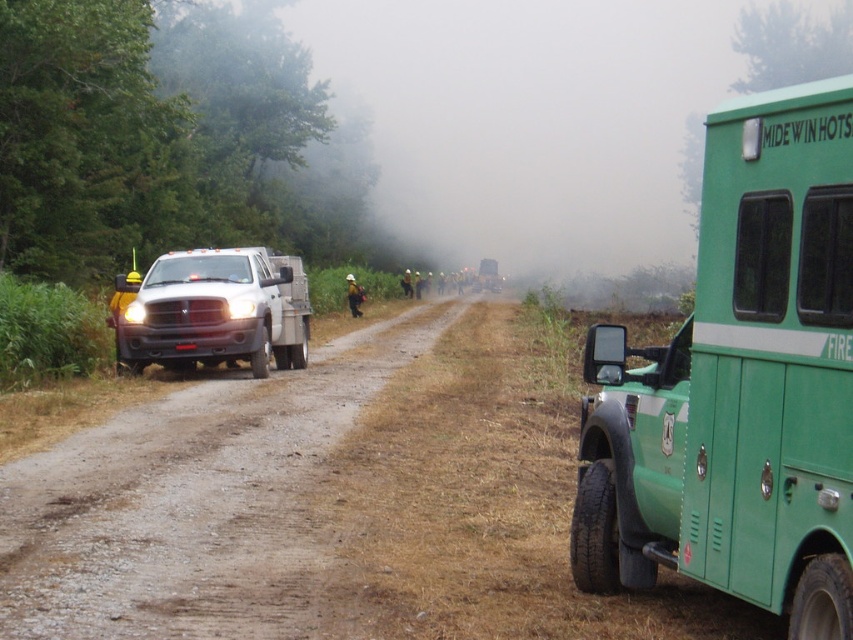
Question: Which object is closer to the camera taking this photo?

Choices:
 (A) green matte truck at right
 (B) dusty gravel road at center
 (C) matte white truck at left

Answer: (B)

Question: Is green matte truck at right bigger than matte white truck at left?

Choices:
 (A) yes
 (B) no

Answer: (B)

Question: Can you confirm if green matte truck at right is positioned above dusty gravel road at center?

Choices:
 (A) yes
 (B) no

Answer: (A)

Question: In this image, where is green matte truck at right located relative to matte white truck at left?

Choices:
 (A) above
 (B) below

Answer: (B)

Question: Which point appears closest to the camera in this image?

Choices:
 (A) (247, 252)
 (B) (349, 333)

Answer: (A)

Question: Among these points, which one is farthest from the camera?

Choices:
 (A) (271, 260)
 (B) (293, 509)
 (C) (816, 83)

Answer: (A)